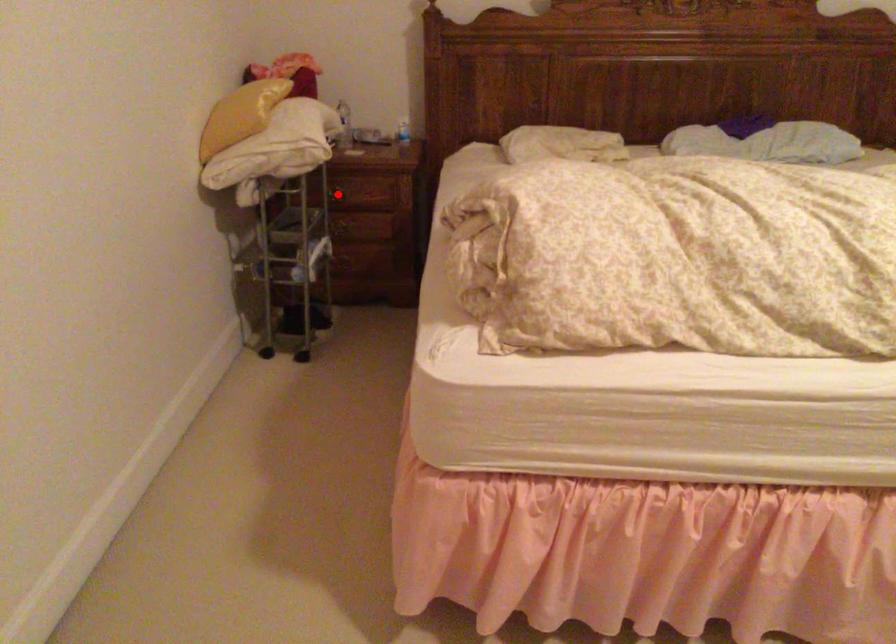
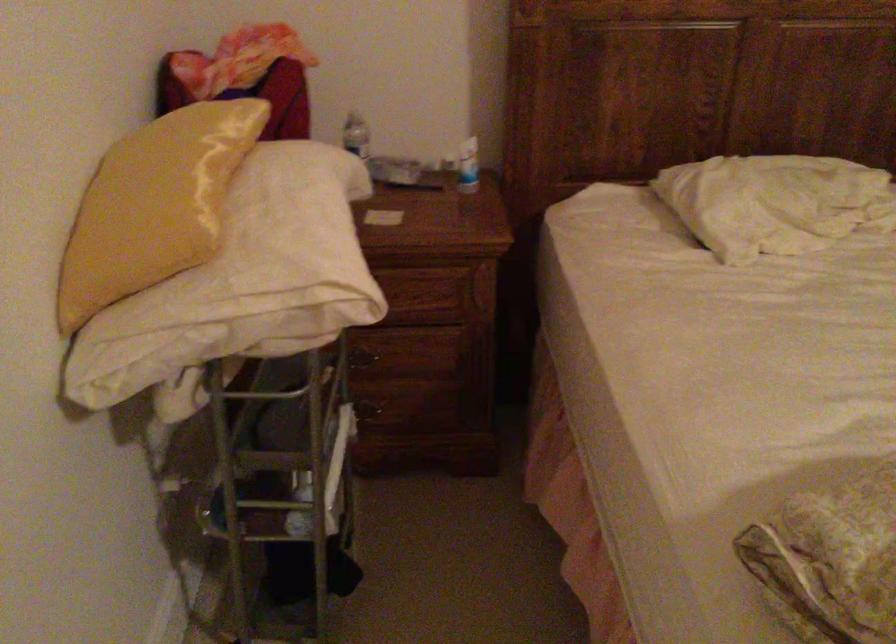
Question: I am providing you with two images of the same scene from different viewpoints. A red point is marked on the first image. At the location where the point appears in image 1, is it still visible in image 2?

Choices:
 (A) Yes
 (B) No

Answer: (B)